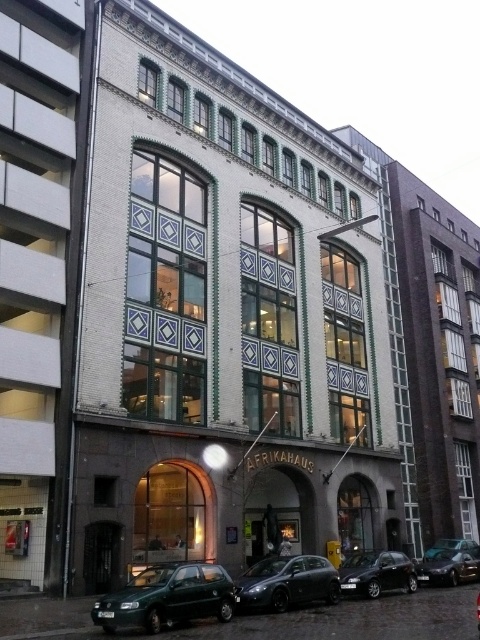
Is point (15, 172) positioned behind point (264, 602)?

That is True.

This screenshot has height=640, width=480. In order to click on white brick building at left in this screenshot , I will do pos(37,276).

In the scene shown: Who is more distant from viewer, [156,596] or [272,605]?

The point [272,605] is behind.

You are a GUI agent. You are given a task and a screenshot of the screen. Output one action in this format:
    pyautogui.click(x=<x>, y=<y>)
    Task: Click on the metallic green hatchback at lower left
    Image resolution: width=480 pixels, height=640 pixels.
    Given the screenshot: What is the action you would take?
    pyautogui.click(x=168, y=596)

Identify the location of metallic green hatchback at lower left. (168, 596).

Measure the distance between matte gray car at center and shiny black sedan at lower right.

A distance of 14.16 meters exists between matte gray car at center and shiny black sedan at lower right.

Is matte gray car at center to the right of shiny black sedan at lower right from the viewer's perspective?

Incorrect, matte gray car at center is not on the right side of shiny black sedan at lower right.

Identify the location of matte gray car at center. The image size is (480, 640). click(x=287, y=582).

The image size is (480, 640). I want to click on matte gray car at center, so click(287, 582).